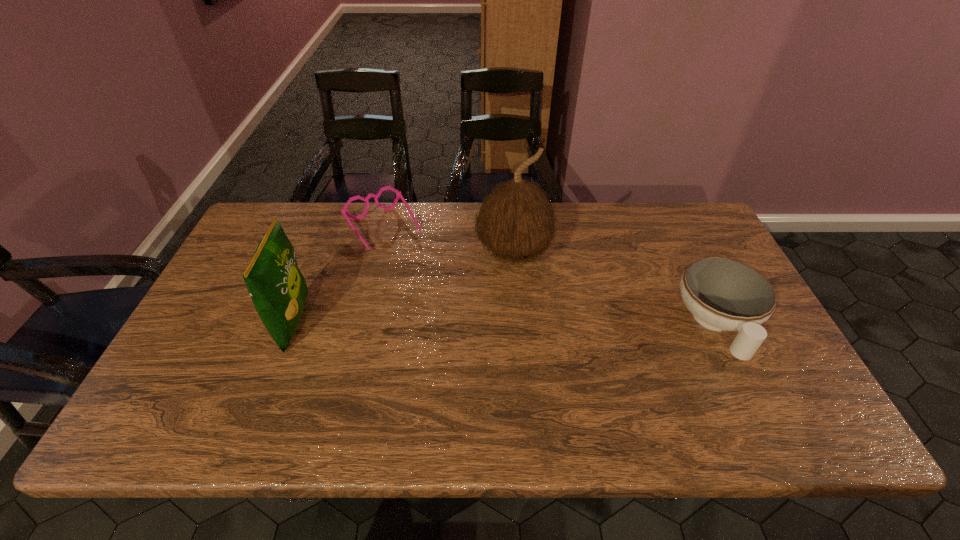
This screenshot has width=960, height=540. I want to click on empty location between the third tallest object and the spectacles, so click(x=550, y=276).

The image size is (960, 540). Find the location of `vacant area between the spectacles and the tallest object`. vacant area between the spectacles and the tallest object is located at coordinates (448, 240).

Image resolution: width=960 pixels, height=540 pixels. Identify the location of free spot between the second object from right to left and the second shortest object. (615, 289).

Find the location of a particular element. Image resolution: width=960 pixels, height=540 pixels. free space between the spectacles and the rightmost object is located at coordinates (550, 276).

Where is `object that is the second closest one to the shortest object`? object that is the second closest one to the shortest object is located at coordinates (515, 222).

Find the location of a particular element. The height and width of the screenshot is (540, 960). object that can be found as the closest to the rightmost object is located at coordinates (515, 222).